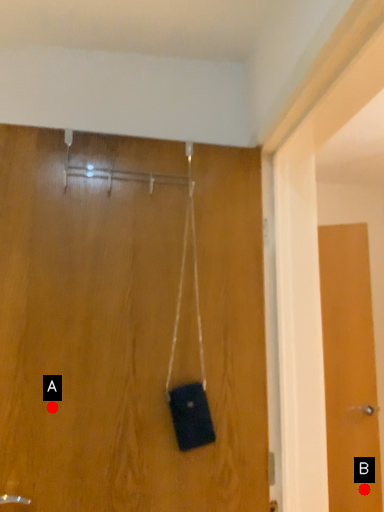
Question: Two points are circled on the image, labeled by A and B beside each circle. Among these points, which one is nearest to the camera?

Choices:
 (A) A is closer
 (B) B is closer

Answer: (A)